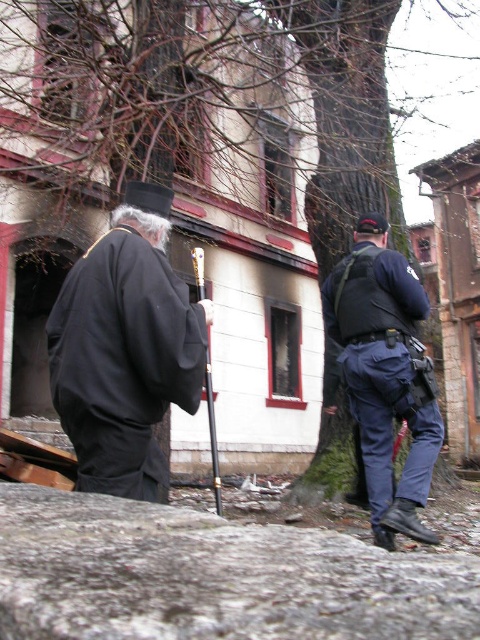
You are a delivery person who needs to place a small package on the gray rough stone at lower center or the navy blue uniform at right. Which surface can accommodate the package more comfortably?

The gray rough stone at lower center has a smaller size compared to navy blue uniform at right, so the navy blue uniform at right can accommodate the package more comfortably due to its larger surface area.

You are a photographer aiming to capture a closeup shot of the gray rough stone at lower center. Given that your camera can focus on objects within 30 inches, will you need to move closer or farther away to get a clear shot?

The gray rough stone at lower center is 33.50 inches from the camera, which is beyond the 30 inches focusing range. Therefore, you need to move closer to within 30 inches to capture a clear closeup.

Consider the image. You are standing in front of the dilapidated building and see the black matte robe at left and the navy blue uniform at right. Which person is nearer to you?

The black matte robe at left is closer to the viewer than the navy blue uniform at right.